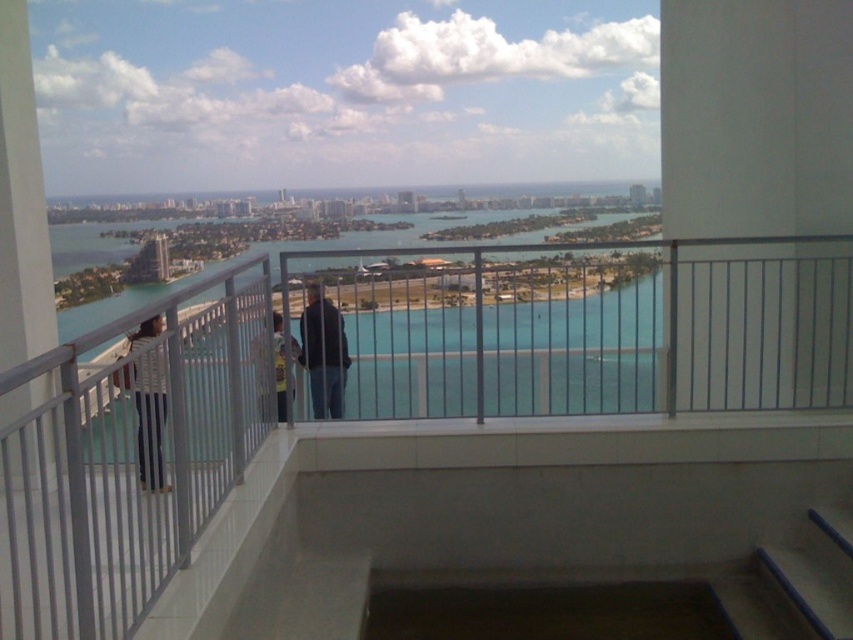
Question: Is white metal railing at upper center wider than white fabric at left?

Choices:
 (A) no
 (B) yes

Answer: (B)

Question: Among these objects, which one is farthest from the camera?

Choices:
 (A) yellow t-shirt at center
 (B) white fabric at left
 (C) white metal railing at upper center
 (D) dark blue jeans at center

Answer: (D)

Question: Is white metal railing at upper center positioned behind dark blue jeans at center?

Choices:
 (A) no
 (B) yes

Answer: (A)

Question: Is white fabric at left to the left of dark blue jeans at center from the viewer's perspective?

Choices:
 (A) no
 (B) yes

Answer: (B)

Question: Which object is farther from the camera taking this photo?

Choices:
 (A) dark blue jeans at center
 (B) white fabric at left

Answer: (A)

Question: Which object is farther from the camera taking this photo?

Choices:
 (A) yellow t-shirt at center
 (B) white fabric at left
 (C) dark blue jeans at center

Answer: (C)